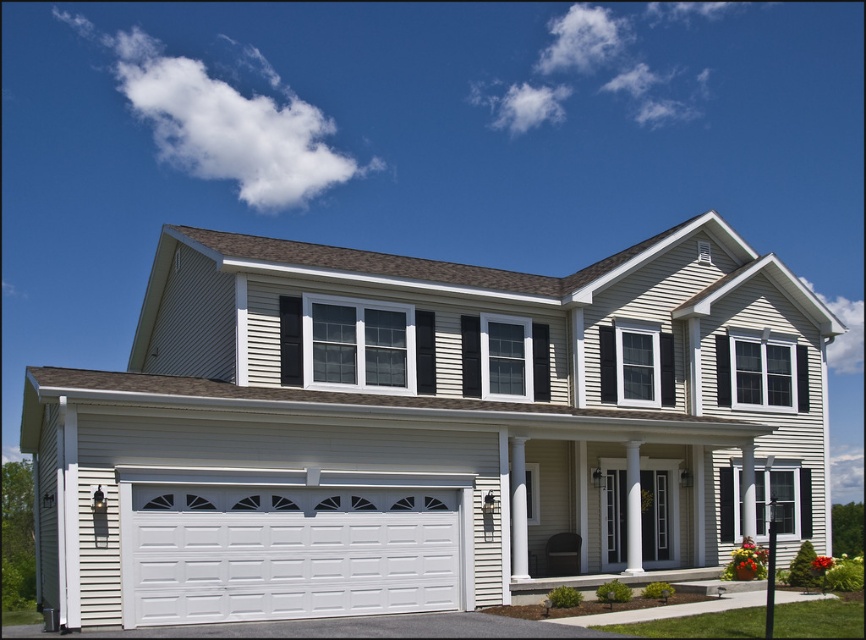
You are a delivery person arriving at this house with a package. You need to park your vehicle on the gray asphalt driveway at lower center but want to ensure it won not block the white painted wood garage door at lower left. Based on their positions, is this possible?

The white painted wood garage door at lower left is located above the gray asphalt driveway at lower center. Since the driveway is below the garage door, you can park on the driveway without blocking the garage door as they are positioned vertically apart.